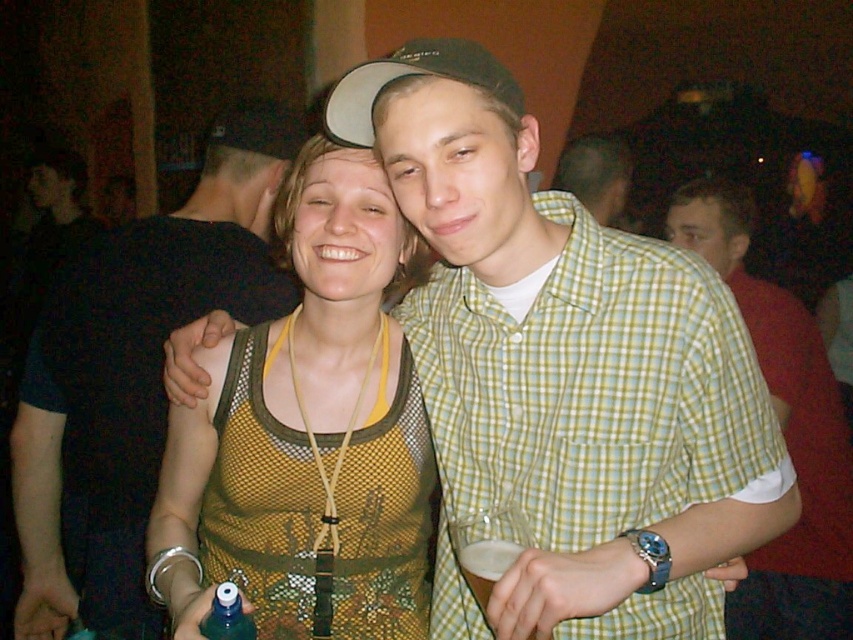
Question: Does green checkered shirt at center have a greater width compared to foamy white liquid at lower center?

Choices:
 (A) yes
 (B) no

Answer: (A)

Question: Among these objects, which one is farthest from the camera?

Choices:
 (A) matte green shirt at center
 (B) transparent plastic bottle at lower left

Answer: (A)

Question: Based on their relative distances, which object is farther from the foamy white liquid at lower center?

Choices:
 (A) yellow-green checkered shirt at center-right
 (B) matte green shirt at center
 (C) green mesh tank top at center
 (D) transparent plastic bottle at lower left

Answer: (B)

Question: Which point is closer to the camera?

Choices:
 (A) (656, 621)
 (B) (784, 321)

Answer: (A)

Question: Is green checkered shirt at center positioned in front of black fabric shirt at left?

Choices:
 (A) yes
 (B) no

Answer: (A)

Question: Is yellow-green checkered shirt at center-right positioned at the back of matte green shirt at center?

Choices:
 (A) no
 (B) yes

Answer: (A)